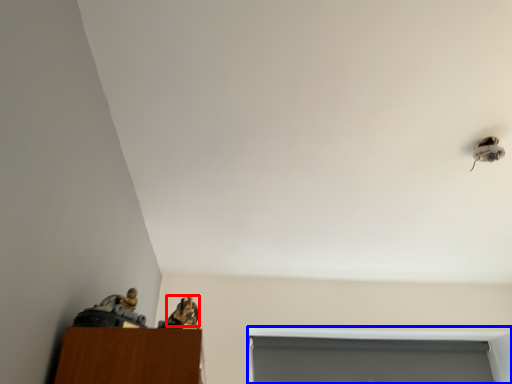
Question: Among these objects, which one is nearest to the camera, animal (highlighted by a red box) or window (highlighted by a blue box)?

Choices:
 (A) animal
 (B) window

Answer: (A)